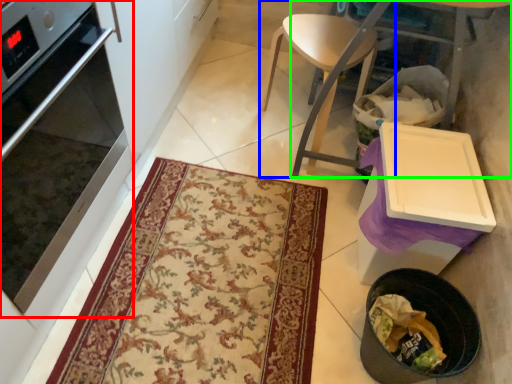
Question: Which object is the closest to the oven (highlighted by a red box)? Choose among these: chair (highlighted by a blue box) or table (highlighted by a green box).

Choices:
 (A) chair
 (B) table

Answer: (A)